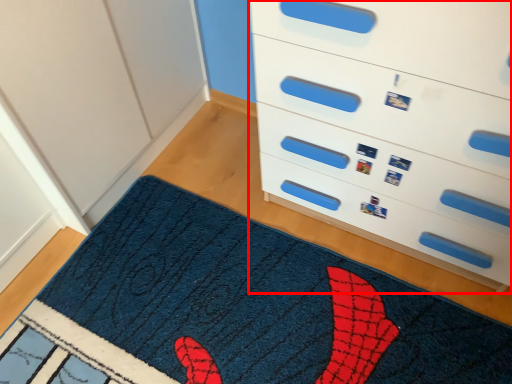
Question: From the image's perspective, what is the correct spatial positioning of chest of drawers (annotated by the red box) in reference to mat?

Choices:
 (A) above
 (B) below

Answer: (A)